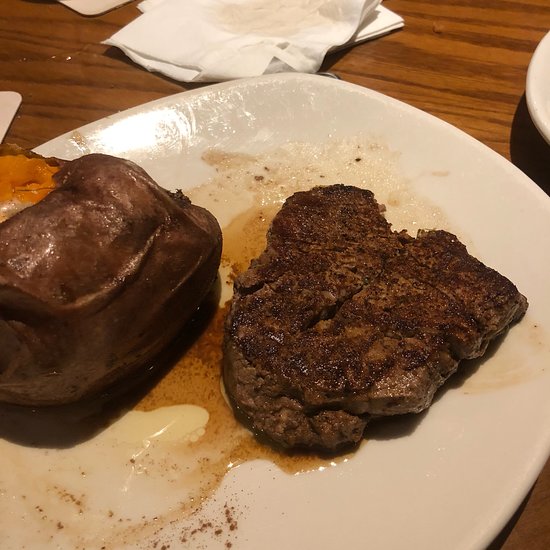
The image size is (550, 550). Identify the location of plate. (416, 481).